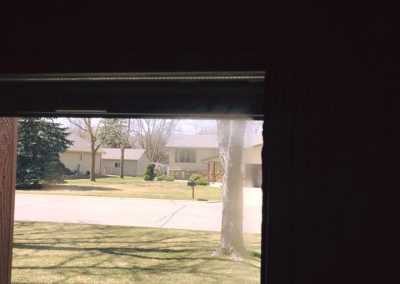
This screenshot has height=284, width=400. Identify the location of wall. (316, 209).